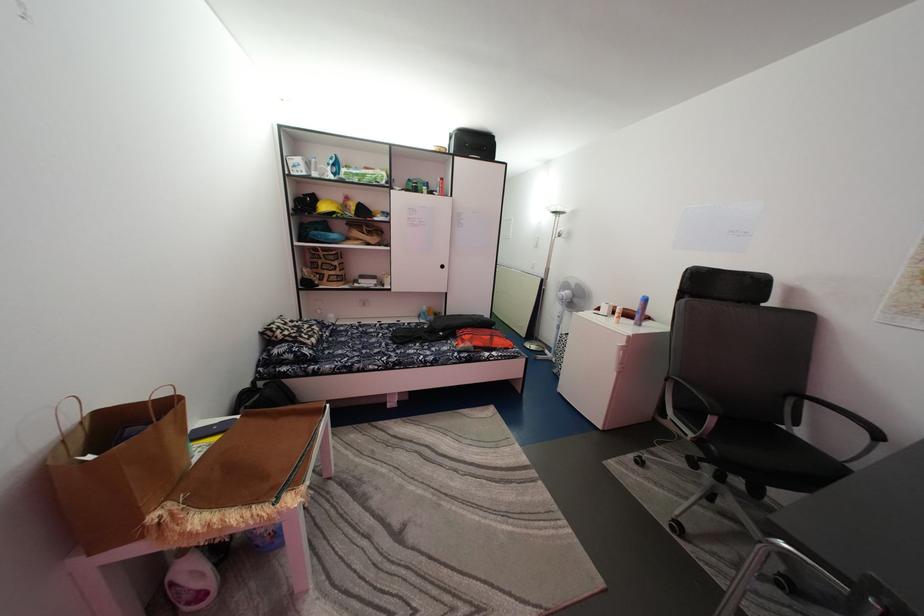
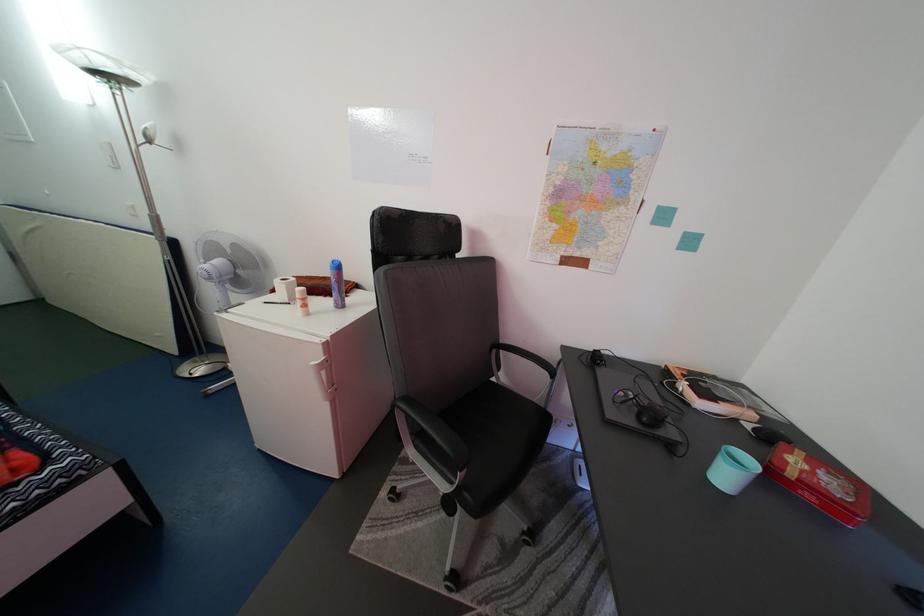
Where in the second image is the point corresponding to pixel 586 292 from the first image?

(244, 253)